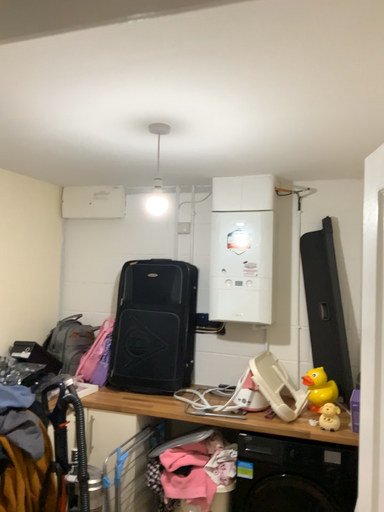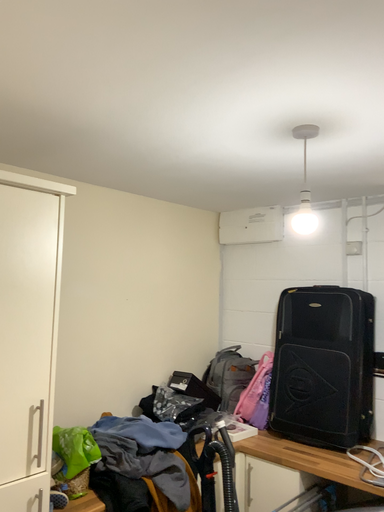
Question: Which way did the camera rotate in the video?

Choices:
 (A) rotated left
 (B) rotated right

Answer: (A)